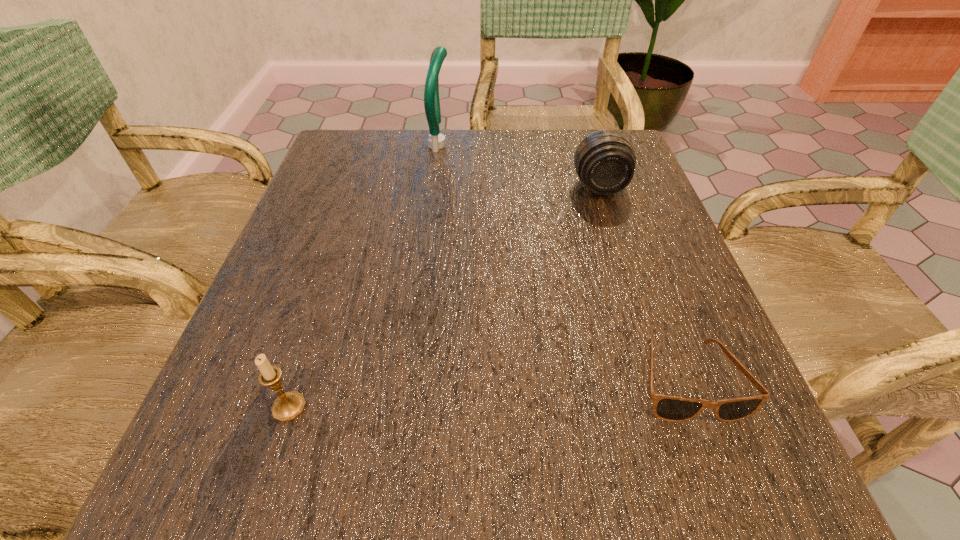
Find the location of `free space at the near right corner of the desktop`. free space at the near right corner of the desktop is located at coordinates (676, 460).

Locate an element on the screen. The height and width of the screenshot is (540, 960). vacant space that's between the sunglasses and the third object from right to left is located at coordinates (564, 263).

I want to click on vacant area that lies between the candle holder and the second object from left to right, so click(365, 276).

Locate an element on the screen. The height and width of the screenshot is (540, 960). vacant space in between the leftmost object and the sunglasses is located at coordinates (489, 394).

Find the location of a particular element. vacant space that's between the bottle opener and the third nearest object is located at coordinates (520, 166).

At what (x,y) coordinates should I click in order to perform the action: click on free space between the candle holder and the telephoto lens. Please return your answer as a coordinate pair (x, y). The height and width of the screenshot is (540, 960). Looking at the image, I should click on (444, 297).

Locate an element on the screen. This screenshot has height=540, width=960. vacant space that's between the third nearest object and the bottle opener is located at coordinates (520, 166).

Locate an element on the screen. vacant space that is in between the shortest object and the telephoto lens is located at coordinates (643, 284).

Where is `unoccupied area between the sunglasses and the bottle opener`? The image size is (960, 540). unoccupied area between the sunglasses and the bottle opener is located at coordinates (564, 263).

At what (x,y) coordinates should I click in order to perform the action: click on vacant point located between the telephoto lens and the bottle opener. Please return your answer as a coordinate pair (x, y). This screenshot has width=960, height=540. Looking at the image, I should click on (520, 166).